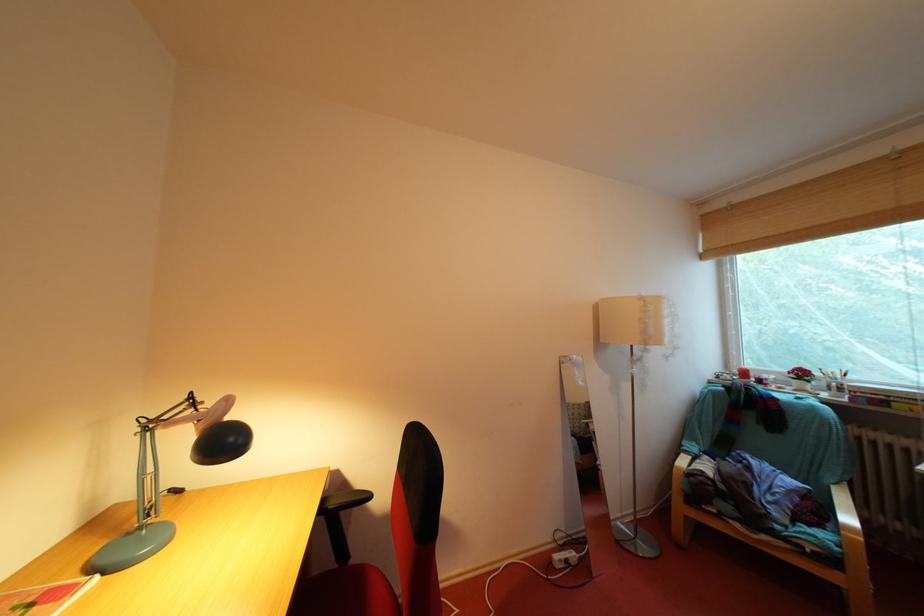
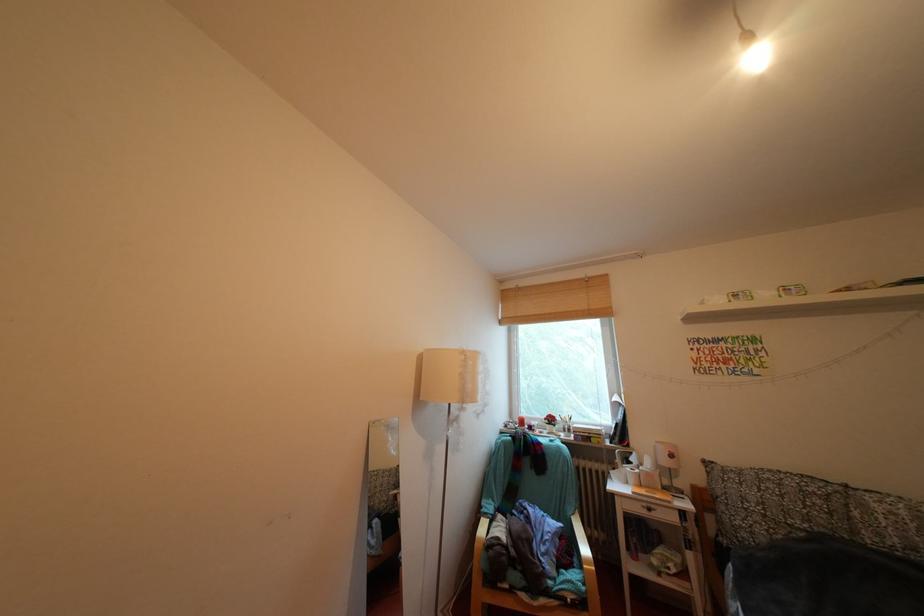
Question: How did the camera likely rotate?

Choices:
 (A) Left
 (B) Right
 (C) Up
 (D) Down

Answer: (B)